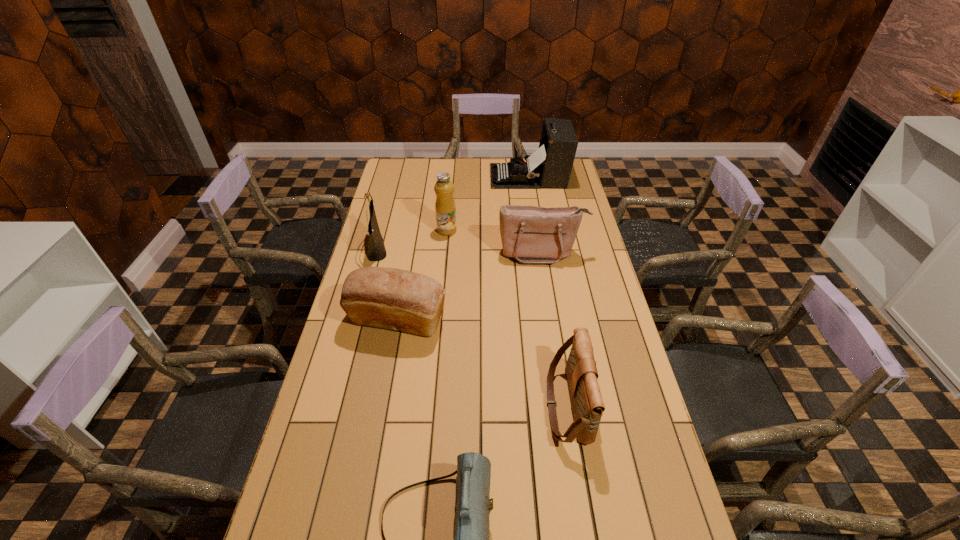
The height and width of the screenshot is (540, 960). I want to click on vacant region at the right edge of the desktop, so click(x=548, y=203).

In the image, there is a desktop. Identify the location of vacant space at the far left corner. The height and width of the screenshot is (540, 960). (419, 167).

Where is `vacant space that is in between the second nearest object and the bread`? The width and height of the screenshot is (960, 540). vacant space that is in between the second nearest object and the bread is located at coordinates (483, 363).

The image size is (960, 540). Find the location of `free point between the third farthest shoulder bag and the tallest shoulder bag`. free point between the third farthest shoulder bag and the tallest shoulder bag is located at coordinates (472, 327).

At what (x,y) coordinates should I click in order to perform the action: click on free area in between the fruit juice and the second nearest object. Please return your answer as a coordinate pair (x, y). Looking at the image, I should click on (507, 318).

You are a GUI agent. You are given a task and a screenshot of the screen. Output one action in this format:
    pyautogui.click(x=<x>, y=<y>)
    Task: Click on the free space that is in between the fruit juice and the typewriter
    This screenshot has height=540, width=960.
    Given the screenshot: What is the action you would take?
    pyautogui.click(x=488, y=204)

Identify the location of object that ranks as the fifth closest to the third farthest shoulder bag. [376, 251].

Locate an element on the screen. This screenshot has height=540, width=960. object that is the fourth closest to the sixth farthest object is located at coordinates (445, 207).

Identify which shoulder bag is the third nearest to the nearest object. Please provide its 2D coordinates. Your answer should be formatted as a tuple, i.e. [(x, y)], where the tuple contains the x and y coordinates of a point satisfying the conditions above.

[(376, 251)]

Identify the location of shoulder bag object that ranks as the third closest to the tallest shoulder bag. The image size is (960, 540). (471, 539).